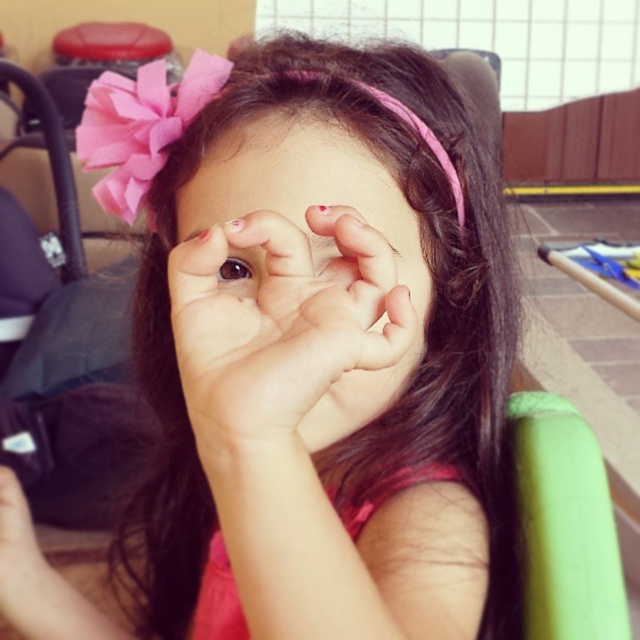
Question: Which object is farther from the camera taking this photo?

Choices:
 (A) smooth skin face at center
 (B) brown shiny eye at center

Answer: (B)

Question: Is the position of smooth skin face at center more distant than that of brown shiny eye at center?

Choices:
 (A) yes
 (B) no

Answer: (B)

Question: Which of the following is the closest to the observer?

Choices:
 (A) smooth skin face at center
 (B) brown shiny eye at center

Answer: (A)

Question: Which point is farther from the camera taking this photo?

Choices:
 (A) (282, 196)
 (B) (236, 260)

Answer: (B)

Question: Is smooth skin face at center smaller than brown shiny eye at center?

Choices:
 (A) no
 (B) yes

Answer: (A)

Question: Does smooth skin face at center have a smaller size compared to brown shiny eye at center?

Choices:
 (A) no
 (B) yes

Answer: (A)